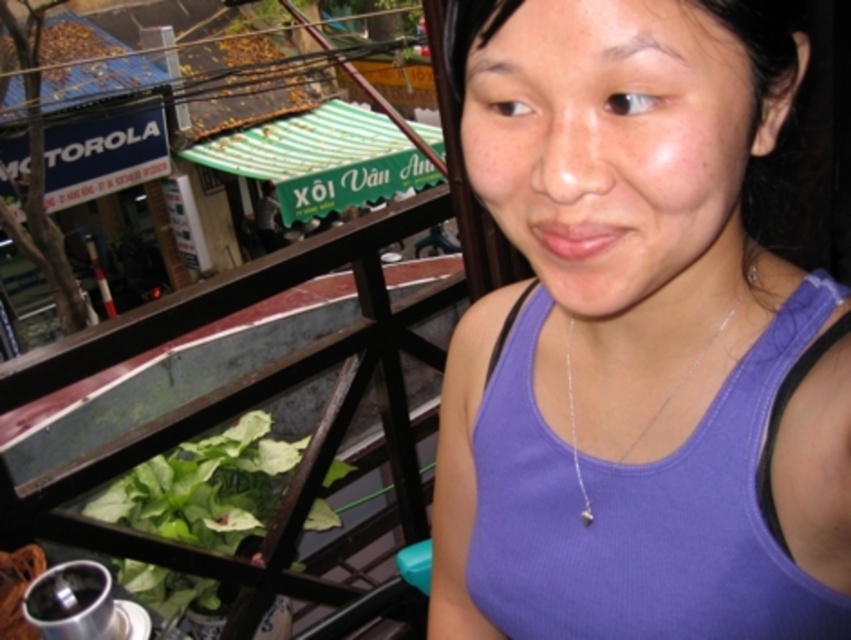
Question: Can you confirm if purple ribbed tank top at center is positioned below silver chain at center?

Choices:
 (A) yes
 (B) no

Answer: (A)

Question: Does purple ribbed tank top at center have a lesser width compared to silver chain at center?

Choices:
 (A) no
 (B) yes

Answer: (A)

Question: Which of the following is the farthest from the observer?

Choices:
 (A) (490, 634)
 (B) (572, 410)

Answer: (A)

Question: Which point is farther to the camera?

Choices:
 (A) (843, 621)
 (B) (661, 401)

Answer: (B)

Question: Can you confirm if purple ribbed tank top at center is positioned below silver chain at center?

Choices:
 (A) yes
 (B) no

Answer: (A)